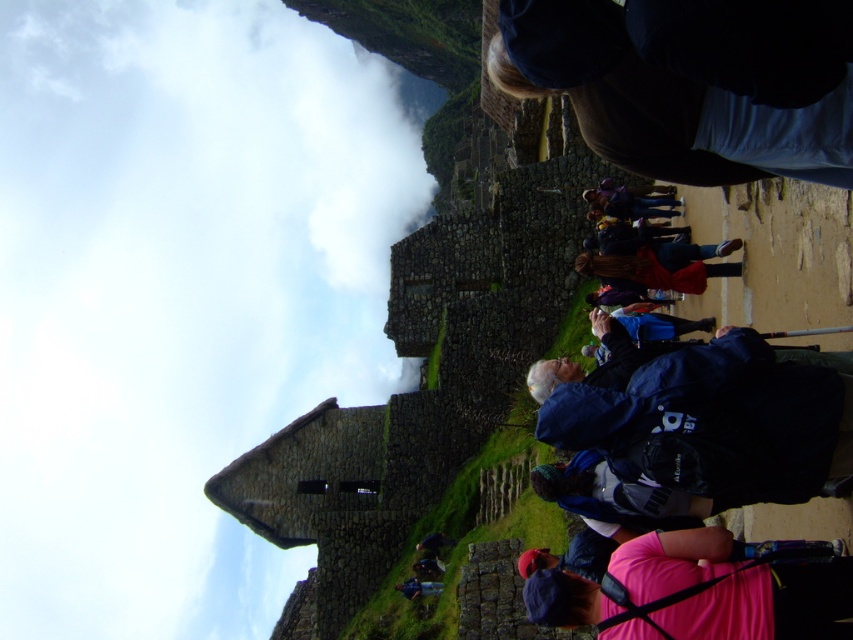
You are a tourist standing at the entrance of Machu Picchu and want to take a photo of the point at coordinates (786, 428). The camera you have can focus up to 40 meters. Will the camera be able to focus on the point?

The distance of point (786, 428) from the camera is 38.88 meters, which is within the camera focus range of up to 40 meters. Therefore, the camera will be able to focus on the point.

You are a drone operator planning to fly a drone between the white fluffy cloud at upper left and the dark blue fabric at upper right. The drone has a maximum flight range of 150 meters. Based on the scene, can the drone safely make the trip between these two points without exceeding its range?

The distance between the white fluffy cloud at upper left and the dark blue fabric at upper right is 163.04 meters. Since the drone has a maximum range of 150 meters, it cannot safely make the trip without exceeding its range.

You are a photographer at Machu Picchu. You notice a white fluffy cloud at upper left and a dark blue fabric at upper right in your frame. Which object appears taller in the photo?

The white fluffy cloud at upper left appears taller than the dark blue fabric at upper right in the photo.